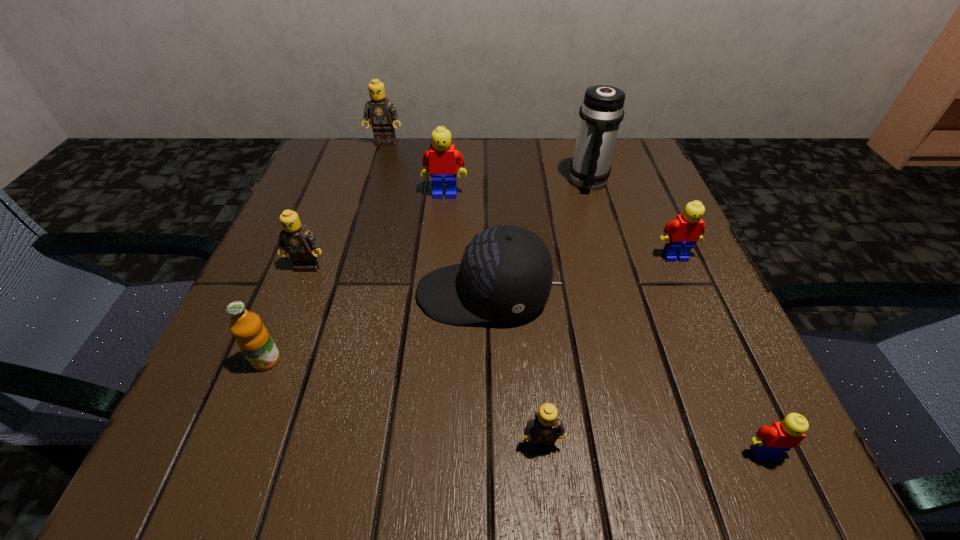
Find the location of a particular element. The image size is (960, 540). free spot between the second biggest tan Lego and the third nearest object is located at coordinates (287, 313).

Locate which object is the fifth closest to the orange juice. Please provide its 2D coordinates. Your answer should be formatted as a tuple, i.e. [(x, y)], where the tuple contains the x and y coordinates of a point satisfying the conditions above.

[(381, 112)]

Locate an element on the screen. The image size is (960, 540). the second closest object to the second nearest yellow Lego is located at coordinates (506, 272).

The height and width of the screenshot is (540, 960). I want to click on the closest Lego to the tallest object, so click(681, 234).

Select which Lego appears as the closest to the farthest object. Please provide its 2D coordinates. Your answer should be formatted as a tuple, i.e. [(x, y)], where the tuple contains the x and y coordinates of a point satisfying the conditions above.

[(443, 160)]

You are a GUI agent. You are given a task and a screenshot of the screen. Output one action in this format:
    pyautogui.click(x=<x>, y=<y>)
    Task: Click on the third closest tan Lego relative to the nearest yellow Lego
    Image resolution: width=960 pixels, height=540 pixels.
    Given the screenshot: What is the action you would take?
    pyautogui.click(x=381, y=112)

Choose which tan Lego is the third nearest neighbor to the nearest yellow Lego. Please provide its 2D coordinates. Your answer should be formatted as a tuple, i.e. [(x, y)], where the tuple contains the x and y coordinates of a point satisfying the conditions above.

[(381, 112)]

Locate an element on the screen. This screenshot has width=960, height=540. yellow Lego that is the closest to the farthest object is located at coordinates (443, 160).

Identify which yellow Lego is the nearest to the thermos bottle. Please provide its 2D coordinates. Your answer should be formatted as a tuple, i.e. [(x, y)], where the tuple contains the x and y coordinates of a point satisfying the conditions above.

[(681, 234)]